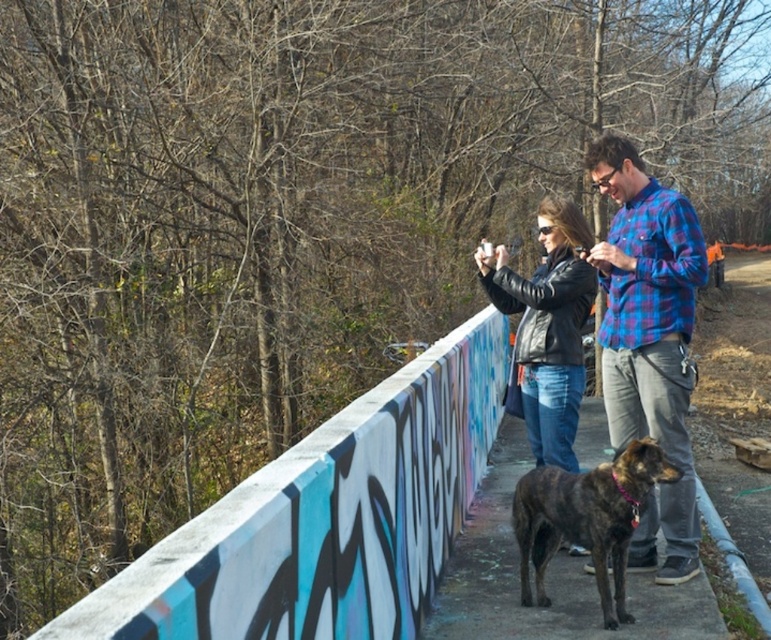
Which is behind, point (507, 547) or point (541, 291)?

Point (507, 547)

Does point (702, 614) come behind point (561, 353)?

No, (702, 614) is closer to viewer.

Is point (642, 605) closer to camera compared to point (571, 554)?

Yes, point (642, 605) is in front of point (571, 554).

This screenshot has height=640, width=771. In order to click on brown textured pavement at lower center in this screenshot , I will do `click(547, 579)`.

Who is positioned more to the right, plaid flannel shirt at center or black leather jacket at center?

Answer: plaid flannel shirt at center

Based on the photo, between plaid flannel shirt at center and black leather jacket at center, which one is positioned lower?

plaid flannel shirt at center is lower down.

The image size is (771, 640). What do you see at coordinates (648, 339) in the screenshot?
I see `plaid flannel shirt at center` at bounding box center [648, 339].

The image size is (771, 640). Identify the location of plaid flannel shirt at center. (648, 339).

Which is behind, point (431, 620) or point (635, 499)?

Positioned behind is point (431, 620).

Which is more to the right, brown textured pavement at lower center or brindle fur dog at lower center?

From the viewer's perspective, brindle fur dog at lower center appears more on the right side.

I want to click on brown textured pavement at lower center, so click(547, 579).